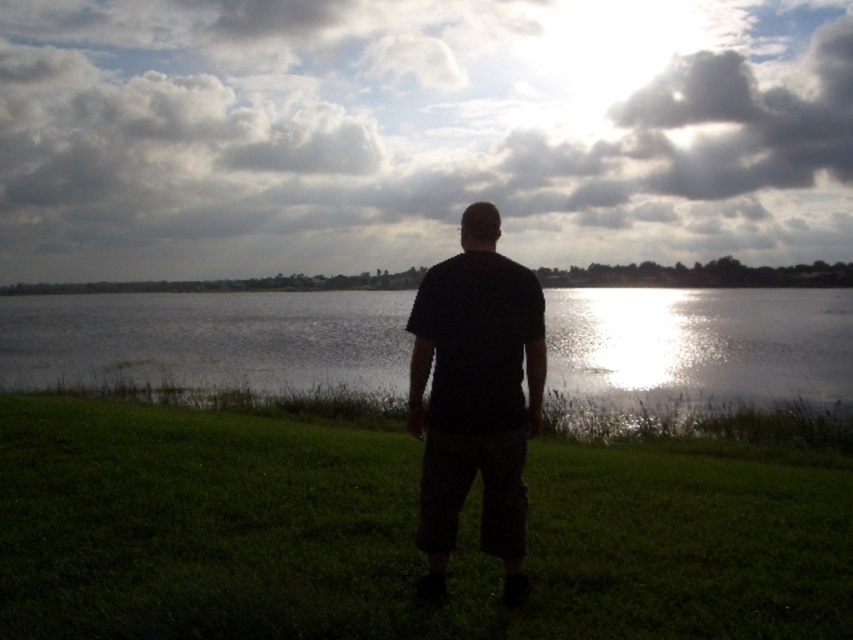
Question: Which point is farther from the camera taking this photo?

Choices:
 (A) (281, 428)
 (B) (515, 314)
 (C) (154, 224)

Answer: (C)

Question: Is cloudy sky at upper center above green grass at center?

Choices:
 (A) yes
 (B) no

Answer: (A)

Question: From the image, what is the correct spatial relationship of cloudy sky at upper center in relation to green grass at center?

Choices:
 (A) above
 (B) below

Answer: (A)

Question: Which is farther from the cloudy sky at upper center?

Choices:
 (A) green grass at center
 (B) glistening water at center
 (C) black matte shirt at center

Answer: (C)

Question: Considering the real-world distances, which object is farthest from the cloudy sky at upper center?

Choices:
 (A) glistening water at center
 (B) green grass at center
 (C) black matte shirt at center

Answer: (C)

Question: In this image, where is green grass at center located relative to glistening water at center?

Choices:
 (A) right
 (B) left

Answer: (A)